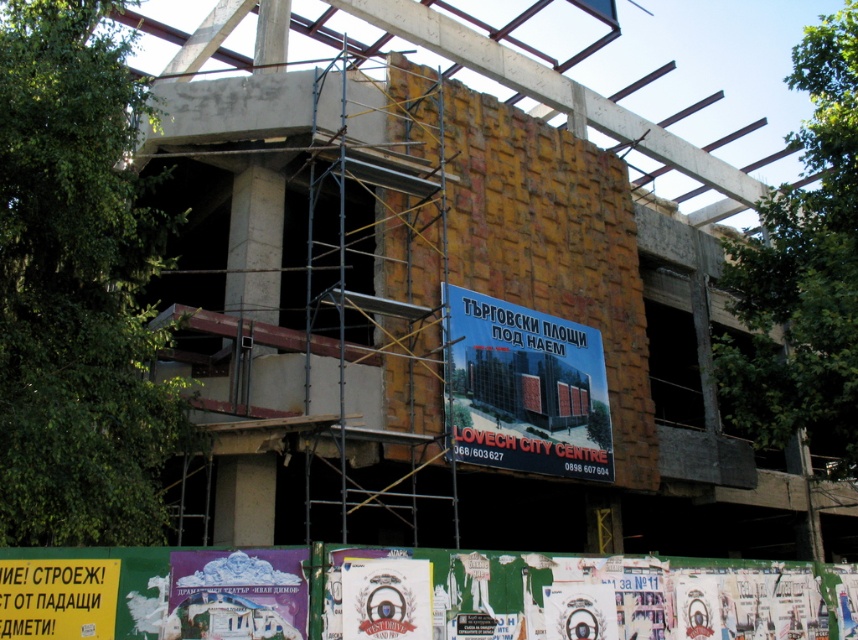
Does point (405, 92) come farther from viewer compared to point (208, 636)?

That is True.

Which is more to the right, yellowish wood scaffolding at center or purple paper at center?

yellowish wood scaffolding at center

Is point (431, 348) in front of point (210, 552)?

No, (431, 348) is further to viewer.

Image resolution: width=858 pixels, height=640 pixels. In order to click on yellowish wood scaffolding at center in this screenshot , I will do `click(379, 316)`.

Is yellowish wood scaffolding at center above matte blue signboard at center?

Actually, yellowish wood scaffolding at center is below matte blue signboard at center.

Between yellowish wood scaffolding at center and matte blue signboard at center, which one has more height?

Standing taller between the two is yellowish wood scaffolding at center.

Is point (448, 449) positioned before point (584, 400)?

Yes.

Where is `yellowish wood scaffolding at center`? yellowish wood scaffolding at center is located at coordinates (379, 316).

Can you confirm if matte blue signboard at center is positioned to the right of purple paper at center?

Yes, matte blue signboard at center is to the right of purple paper at center.

Which of these two, matte blue signboard at center or purple paper at center, stands shorter?

purple paper at center is shorter.

This screenshot has height=640, width=858. Describe the element at coordinates (524, 388) in the screenshot. I see `matte blue signboard at center` at that location.

In order to click on matte blue signboard at center in this screenshot , I will do `click(524, 388)`.